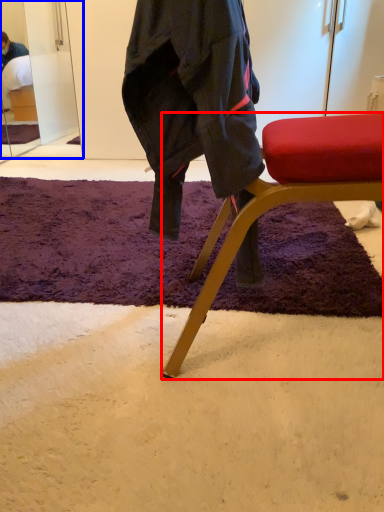
Question: Which of the following is the closest to the observer, chair (highlighted by a red box) or mirror (highlighted by a blue box)?

Choices:
 (A) chair
 (B) mirror

Answer: (A)